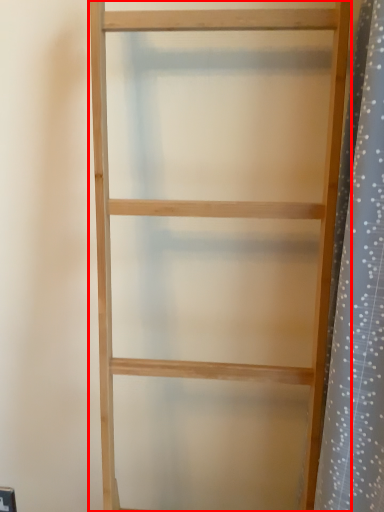
Question: Observing the image, what is the correct spatial positioning of shelf (annotated by the red box) in reference to shower curtain?

Choices:
 (A) left
 (B) right

Answer: (A)